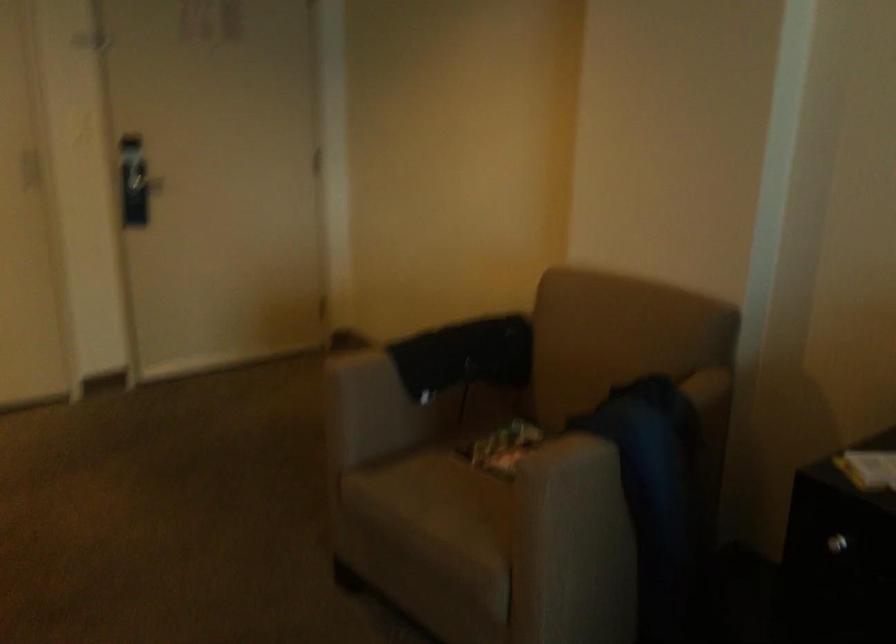
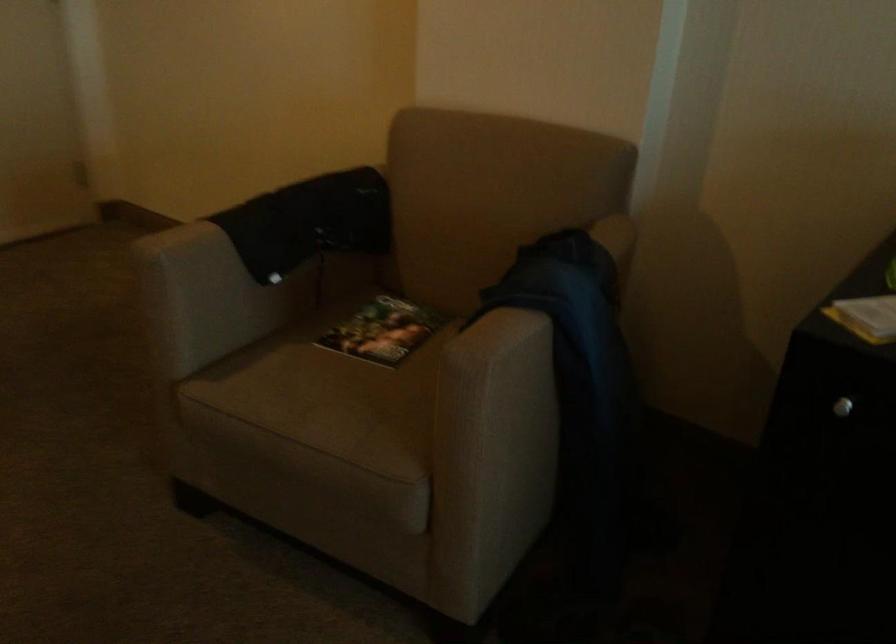
The point at (510, 450) is marked in the first image. Where is the corresponding point in the second image?

(382, 330)